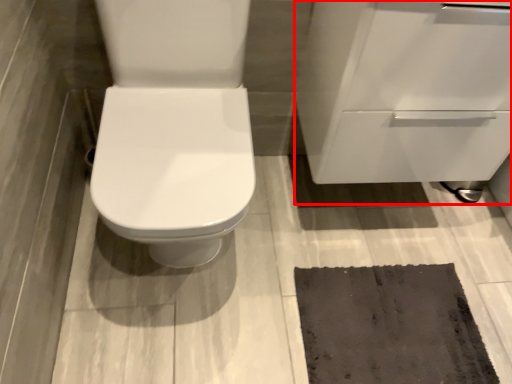
Question: In this image, where is cabinetry (annotated by the red box) located relative to doormat?

Choices:
 (A) right
 (B) left

Answer: (A)